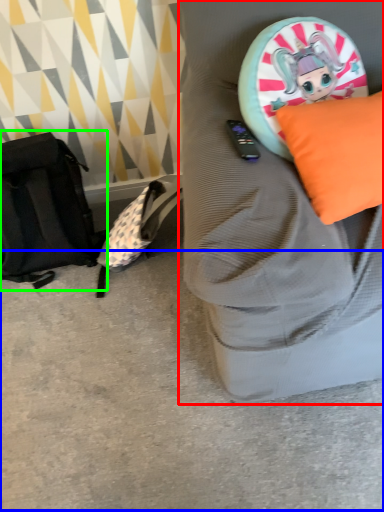
Question: Based on their relative distances, which object is nearer to furniture (highlighted by a red box)? Choose from concrete (highlighted by a blue box) and messenger bag (highlighted by a green box).

Choices:
 (A) concrete
 (B) messenger bag

Answer: (A)